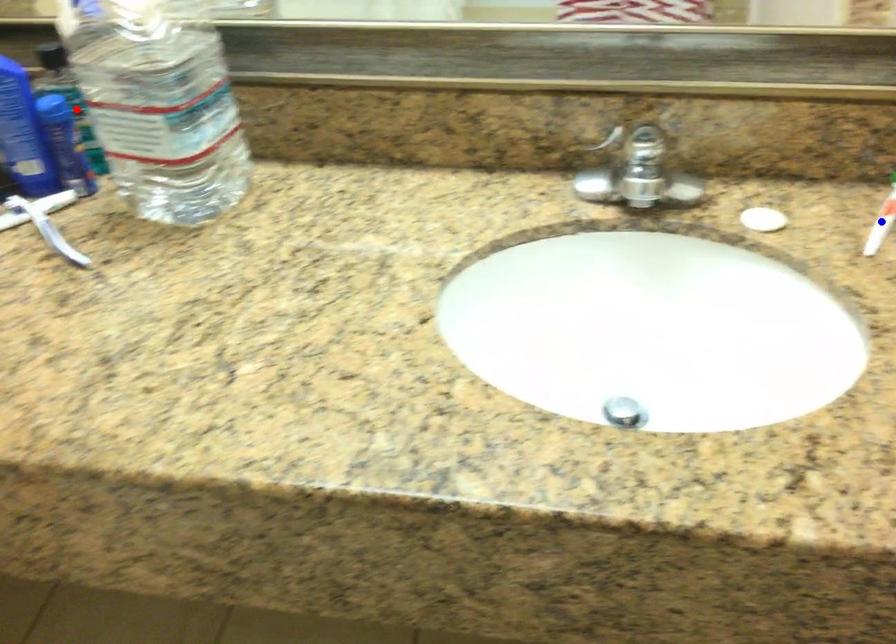
Question: In the image, two points are highlighted. Which point is nearer to the camera? Reply with the corresponding letter.

Choices:
 (A) blue point
 (B) red point

Answer: (A)